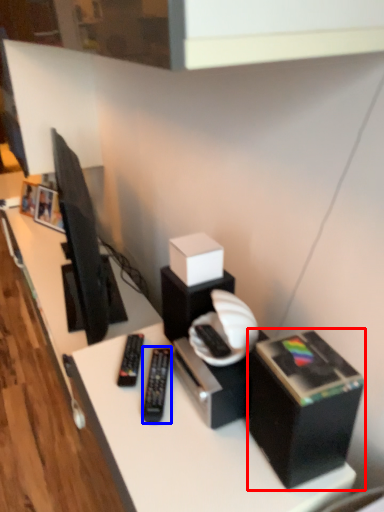
Question: Which of the following is the farthest to the observer, box (highlighted by a red box) or equipment (highlighted by a blue box)?

Choices:
 (A) box
 (B) equipment

Answer: (B)